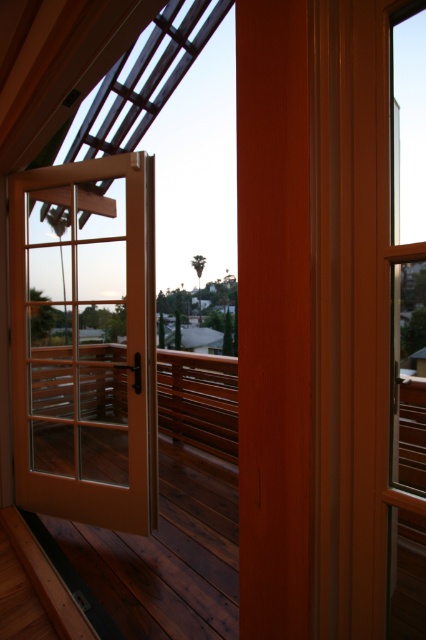
You are a delivery person approaching the building and see the matte glass door at center and the clear glass door at center. Which door should you approach first to enter the building?

You should approach the matte glass door at center first because it is in front of the clear glass door at center, making it the more accessible entrance.

You are standing inside the building and looking through the partially open wooden door. There are two points marked on the deck outside. The first point is at coordinates point (x=88, y=164), and the second is at point (x=207, y=356). Which of these two points is closer to you as you stand inside the building?

Point (x=88, y=164) is closer to the camera than point (x=207, y=356), so the first point is closer to you as you stand inside the building.

You are a delivery person trying to carry a large package through the matte glass door at center and the dark brown wood at center. Which one has a wider opening to pass through?

The matte glass door at center has a larger width than the dark brown wood at center, so the matte glass door at center has a wider opening to pass through.